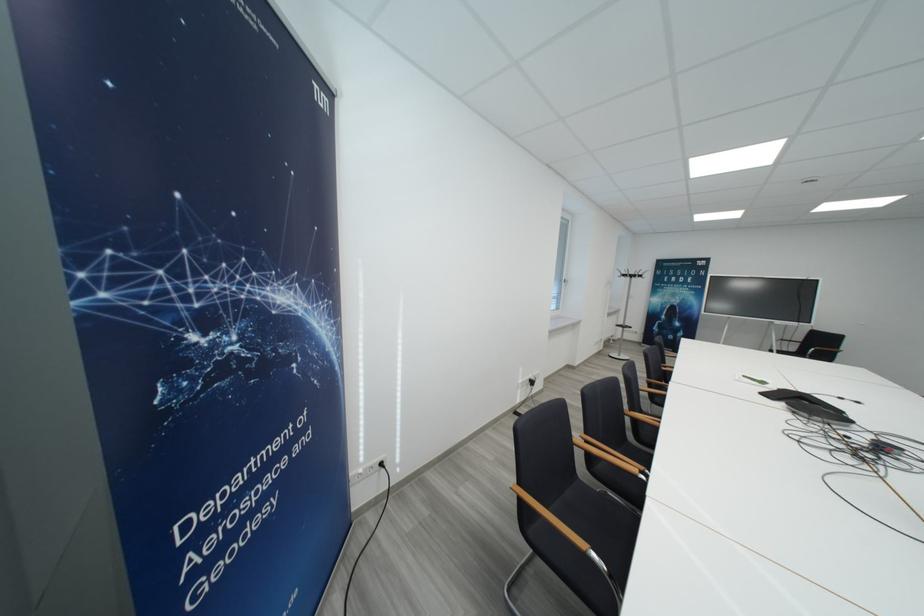
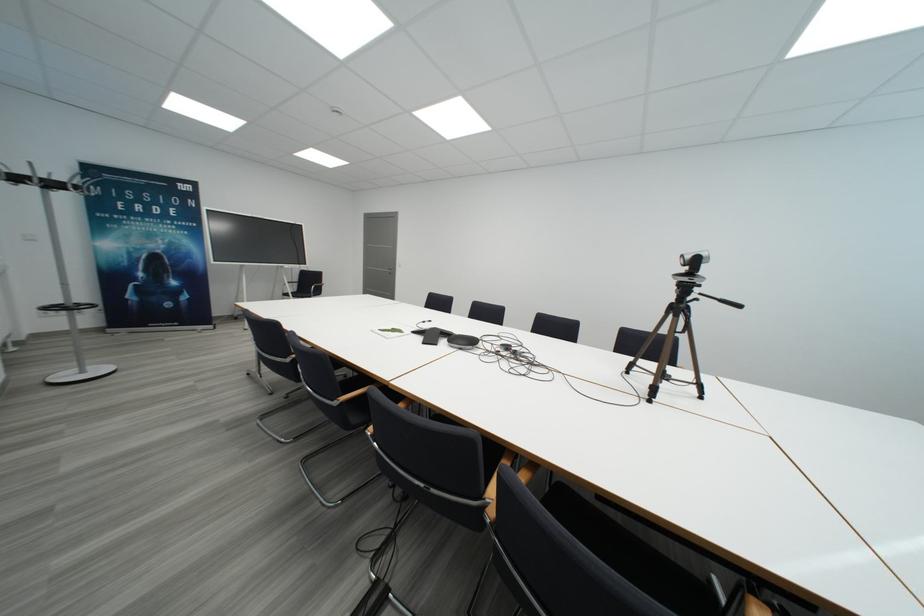
In the second image, find the point that corresponds to point 631,278 in the first image.

(21, 180)